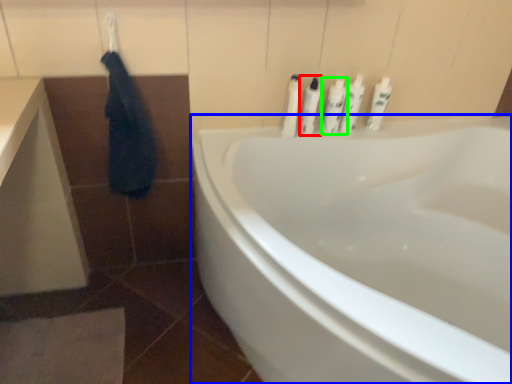
Question: Which object is the closest to the toiletry (highlighted by a red box)? Choose among these: bathtub (highlighted by a blue box) or toiletry (highlighted by a green box).

Choices:
 (A) bathtub
 (B) toiletry

Answer: (B)